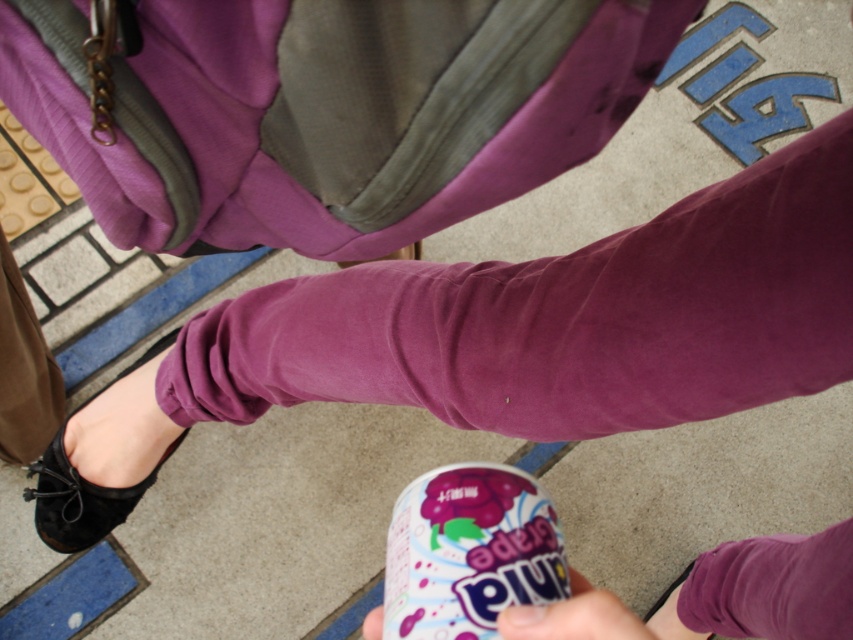
Question: Among these points, which one is farthest from the camera?

Choices:
 (A) (529, 625)
 (B) (57, 472)

Answer: (B)

Question: Which object is positioned closest to the glossy plastic can at lower center?

Choices:
 (A) pink matte can at lower center
 (B) black suede shoe at lower left

Answer: (A)

Question: Which of these objects is positioned farthest from the glossy plastic can at lower center?

Choices:
 (A) black suede shoe at lower left
 (B) pink matte can at lower center

Answer: (A)

Question: Can you confirm if black suede shoe at lower left is bigger than pink matte can at lower center?

Choices:
 (A) no
 (B) yes

Answer: (B)

Question: Is black suede shoe at lower left smaller than pink matte can at lower center?

Choices:
 (A) no
 (B) yes

Answer: (A)

Question: Can you confirm if black suede shoe at lower left is bigger than pink matte can at lower center?

Choices:
 (A) no
 (B) yes

Answer: (B)